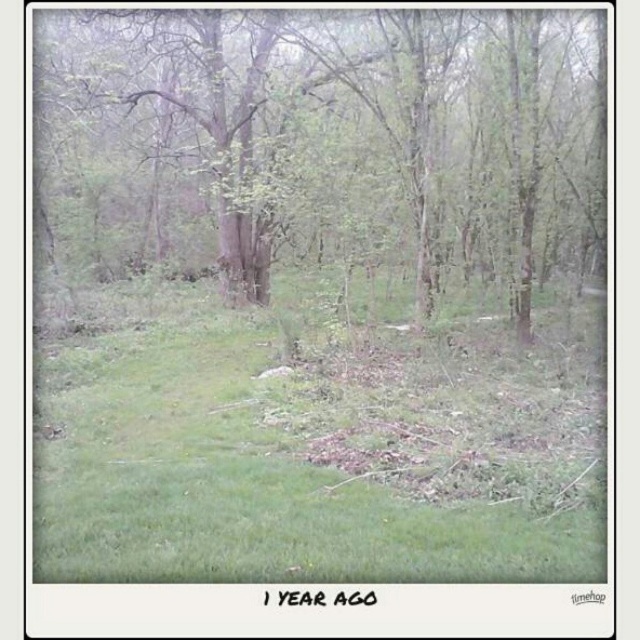
You are a hiker trying to find the narrowest path through the forest. You see the green grassy at center and the green leafy tree at center. Which one has a smaller width, making it easier to navigate around?

The green grassy at center has a lesser width compared to the green leafy tree at center, so it is narrower and easier to navigate around.